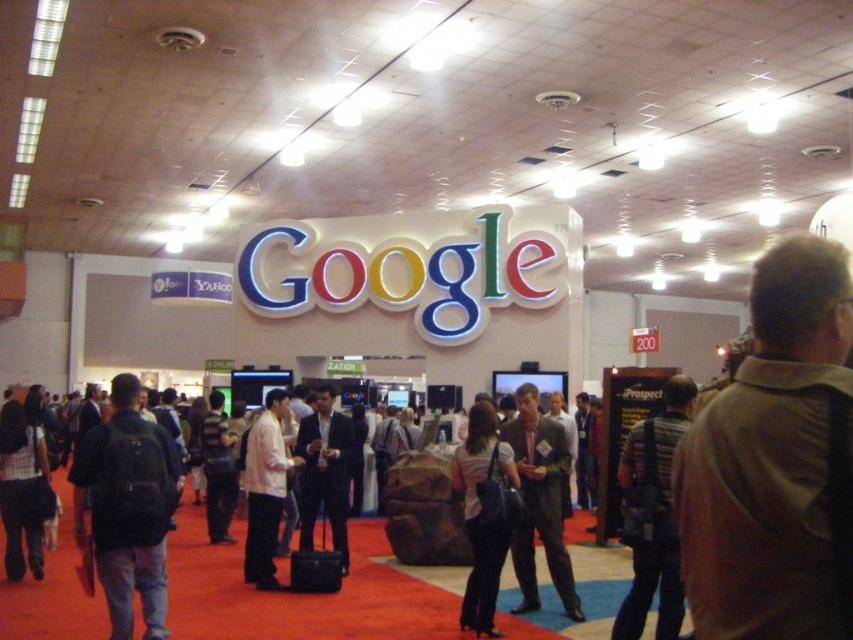
Which is above, black suit at center or dark gray suit at center?

black suit at center

Is black suit at center to the left of dark gray suit at center from the viewer's perspective?

Incorrect, black suit at center is not on the left side of dark gray suit at center.

Is point (328, 449) positioned after point (210, 410)?

No, it is not.

The height and width of the screenshot is (640, 853). Identify the location of black suit at center. (325, 472).

Can you confirm if brown leather jacket at upper right is shorter than black suit at center?

Yes.

In the scene shown: Is brown leather jacket at upper right smaller than black suit at center?

Yes.

Is point (743, 625) in front of point (325, 387)?

Yes, point (743, 625) is closer to viewer.

Image resolution: width=853 pixels, height=640 pixels. I want to click on brown leather jacket at upper right, so (x=770, y=460).

Between striped shirt at center and gray suit at center, which one is positioned lower?

striped shirt at center is lower down.

Does striped shirt at center lie in front of gray suit at center?

Yes, striped shirt at center is closer to the viewer.

Which is behind, point (666, 470) or point (567, 561)?

Positioned behind is point (567, 561).

Locate an element on the screen. striped shirt at center is located at coordinates (653, 515).